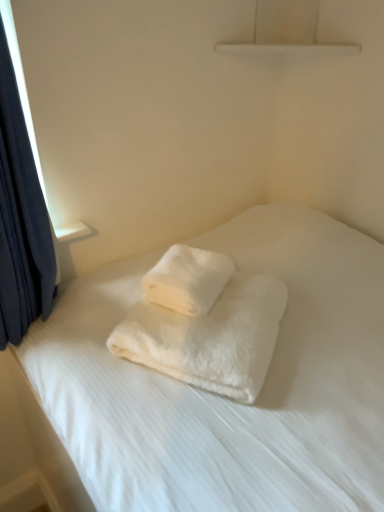
Question: Does white fluffy towel at center, the second towel when ordered from top to bottom, have a larger size compared to white fluffy towel at center, which is the 1th towel from top to bottom?

Choices:
 (A) yes
 (B) no

Answer: (A)

Question: Considering the relative sizes of white fluffy towel at center, the second towel when ordered from top to bottom, and white fluffy towel at center, which is the 1th towel from top to bottom, in the image provided, is white fluffy towel at center, the second towel when ordered from top to bottom, smaller than white fluffy towel at center, which is the 1th towel from top to bottom,?

Choices:
 (A) no
 (B) yes

Answer: (A)

Question: Does white fluffy towel at center, the second towel when ordered from top to bottom, appear on the left side of white fluffy towel at center, which ranks as the 2th towel in bottom-to-top order?

Choices:
 (A) yes
 (B) no

Answer: (B)

Question: From a real-world perspective, does white fluffy towel at center, which is the first towel from bottom to top, stand above white fluffy towel at center, which is the 1th towel from top to bottom?

Choices:
 (A) yes
 (B) no

Answer: (B)

Question: Is white fluffy towel at center, which is the first towel from bottom to top, not within white fluffy towel at center, which is the 1th towel from top to bottom?

Choices:
 (A) yes
 (B) no

Answer: (A)

Question: Do you think white fluffy towels at center is within white fluffy towel at center, which is the 1th towel from top to bottom, or outside of it?

Choices:
 (A) inside
 (B) outside

Answer: (B)

Question: From their relative heights in the image, would you say white fluffy towels at center is taller or shorter than white fluffy towel at center, which ranks as the 2th towel in bottom-to-top order?

Choices:
 (A) tall
 (B) short

Answer: (A)

Question: Considering their positions, is white fluffy towels at center located in front of or behind white fluffy towel at center, which is the 1th towel from top to bottom?

Choices:
 (A) behind
 (B) front

Answer: (B)

Question: In terms of size, does white fluffy towels at center appear bigger or smaller than white fluffy towel at center, which is the 1th towel from top to bottom?

Choices:
 (A) big
 (B) small

Answer: (A)

Question: Considering their positions, is white fluffy towel at center, the second towel when ordered from top to bottom, located in front of or behind white fluffy towels at center?

Choices:
 (A) behind
 (B) front

Answer: (A)

Question: Is point (173, 345) closer or farther from the camera than point (251, 482)?

Choices:
 (A) farther
 (B) closer

Answer: (A)

Question: Considering the positions of white fluffy towel at center, the second towel when ordered from top to bottom, and white fluffy towels at center in the image, is white fluffy towel at center, the second towel when ordered from top to bottom, bigger or smaller than white fluffy towels at center?

Choices:
 (A) small
 (B) big

Answer: (A)

Question: Considering the positions of white fluffy towel at center, the second towel when ordered from top to bottom, and white fluffy towels at center in the image, is white fluffy towel at center, the second towel when ordered from top to bottom, wider or thinner than white fluffy towels at center?

Choices:
 (A) wide
 (B) thin

Answer: (B)

Question: Considering their positions, is white fluffy towel at center, which ranks as the 2th towel in bottom-to-top order, located in front of or behind white fluffy towels at center?

Choices:
 (A) front
 (B) behind

Answer: (B)

Question: In terms of height, does white fluffy towel at center, which ranks as the 2th towel in bottom-to-top order, look taller or shorter compared to white fluffy towels at center?

Choices:
 (A) tall
 (B) short

Answer: (B)